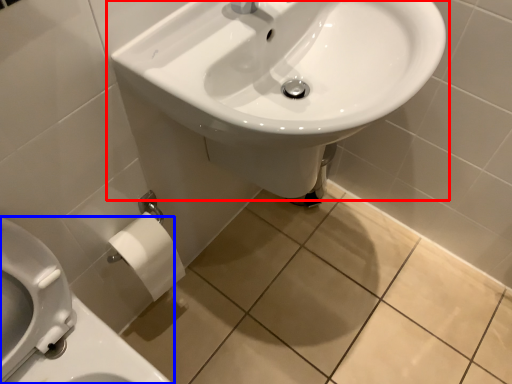
Question: Which object appears farthest to the camera in this image, sink (highlighted by a red box) or toilet (highlighted by a blue box)?

Choices:
 (A) sink
 (B) toilet

Answer: (A)